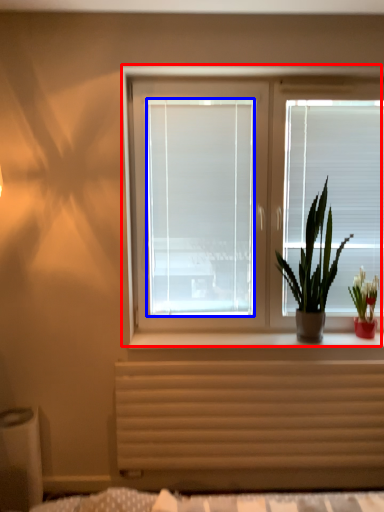
Question: Which of the following is the farthest to the observer, window (highlighted by a red box) or window screen (highlighted by a blue box)?

Choices:
 (A) window
 (B) window screen

Answer: (B)